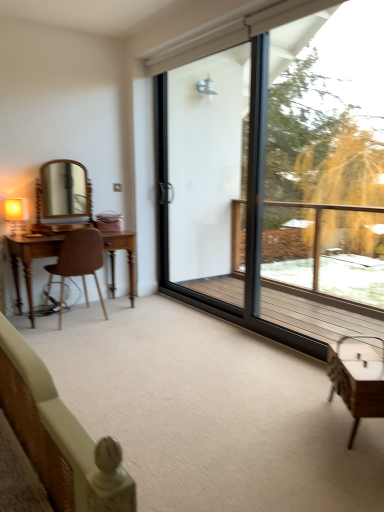
This screenshot has height=512, width=384. Identify the location of vacant space in front of white glossy table at lower right, which is the 1th table from right to left. (354, 459).